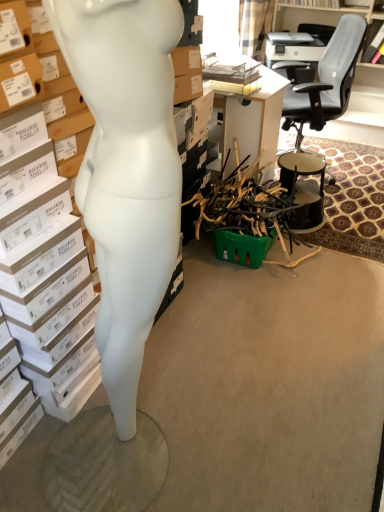
Question: Is white cardboard box at left wider or thinner than white matte mannequin at left?

Choices:
 (A) wide
 (B) thin

Answer: (A)

Question: Considering their positions, is white cardboard box at left located in front of or behind white matte mannequin at left?

Choices:
 (A) behind
 (B) front

Answer: (A)

Question: Estimate the real-world distances between objects in this image. Which object is closer to the black glossy drum at right?

Choices:
 (A) black leather office chair at upper right
 (B) white matte mannequin at left
 (C) white cardboard box at left

Answer: (A)

Question: Estimate the real-world distances between objects in this image. Which object is farther from the white cardboard box at left?

Choices:
 (A) white matte mannequin at left
 (B) black glossy drum at right
 (C) black leather office chair at upper right

Answer: (C)